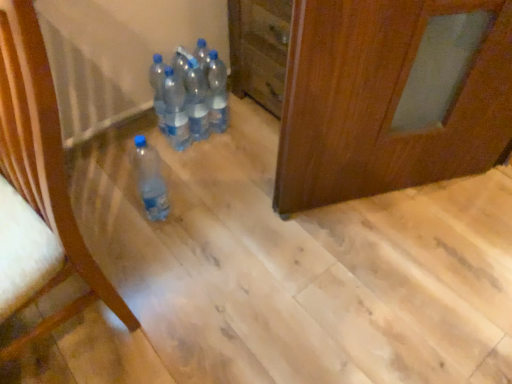
Question: From their relative heights in the image, would you say clear plastic bottle at left is taller or shorter than transparent plastic bottles at center, which appears as the 1th bottle when viewed from the left?

Choices:
 (A) tall
 (B) short

Answer: (A)

Question: From the image's perspective, is clear plastic bottle at left above or below transparent plastic bottles at center, which appears as the 1th bottle when viewed from the left?

Choices:
 (A) above
 (B) below

Answer: (B)

Question: Which of these objects is positioned farthest from the transparent plastic bottles at center, the third bottle positioned from the left?

Choices:
 (A) clear plastic bottle at left
 (B) transparent plastic bottles at center, which appears as the 1th bottle when viewed from the left
 (C) transparent plastic bottles at center, the first bottle positioned from the right
 (D) translucent plastic bottles at center, placed as the 2th bottle when sorted from right to left
 (E) translucent plastic bottle at lower left, marked as the 2th bottle in a left-to-right arrangement

Answer: (A)

Question: Which of these objects is positioned closest to the transparent plastic bottles at center, which appears as the 1th bottle when viewed from the left?

Choices:
 (A) transparent plastic bottles at center, the 3th bottle in the right-to-left sequence
 (B) translucent plastic bottle at lower left, acting as the 4th bottle starting from the right
 (C) clear plastic bottle at left
 (D) transparent plastic bottles at center, the first bottle positioned from the right
 (E) translucent plastic bottles at center, placed as the fourth bottle when sorted from left to right

Answer: (A)